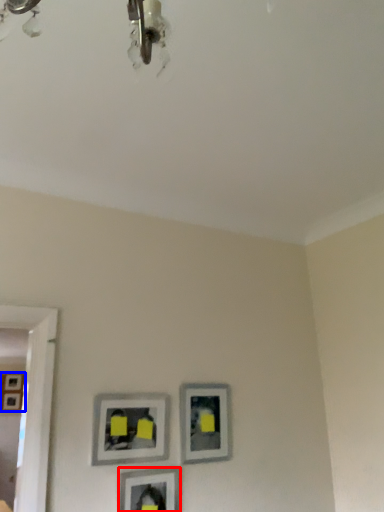
Question: Among these objects, which one is nearest to the camera, picture frame (highlighted by a red box) or picture frame (highlighted by a blue box)?

Choices:
 (A) picture frame
 (B) picture frame

Answer: (A)